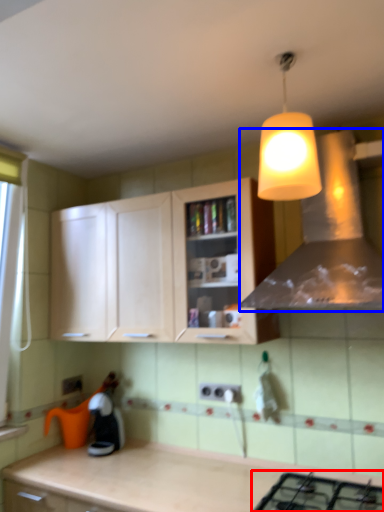
Question: Among these objects, which one is farthest to the camera, gas stove (highlighted by a red box) or vent (highlighted by a blue box)?

Choices:
 (A) gas stove
 (B) vent

Answer: (B)